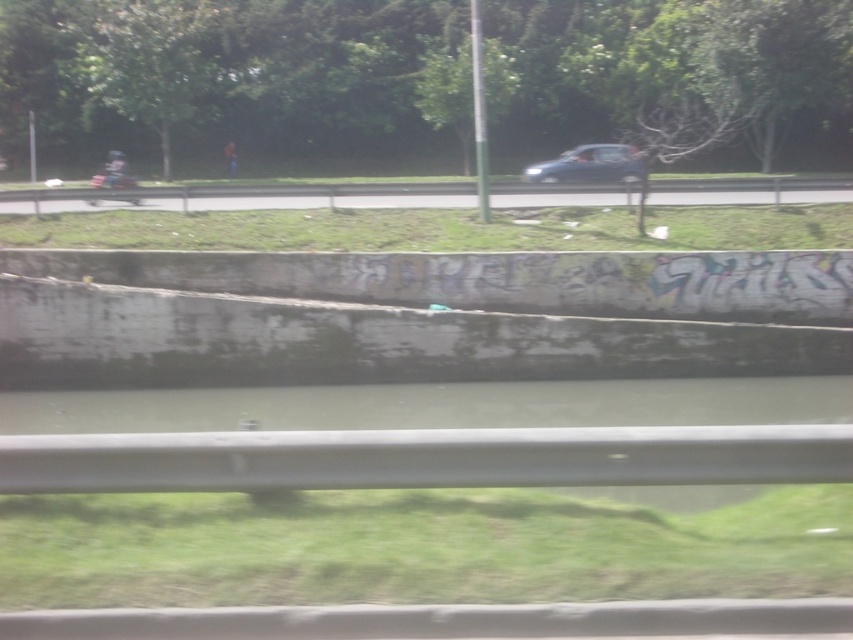
Question: Is gray metallic river at center smaller than satin blue sedan at center?

Choices:
 (A) yes
 (B) no

Answer: (A)

Question: Which point is closer to the camera?

Choices:
 (A) gray metallic river at center
 (B) satin blue sedan at center

Answer: (A)

Question: Which point is farther from the camera taking this photo?

Choices:
 (A) (587, 163)
 (B) (53, 400)

Answer: (A)

Question: Does gray metallic river at center appear under satin blue sedan at center?

Choices:
 (A) yes
 (B) no

Answer: (A)

Question: Is gray metallic river at center thinner than satin blue sedan at center?

Choices:
 (A) no
 (B) yes

Answer: (A)

Question: Among these objects, which one is farthest from the camera?

Choices:
 (A) gray metallic river at center
 (B) satin blue sedan at center

Answer: (B)